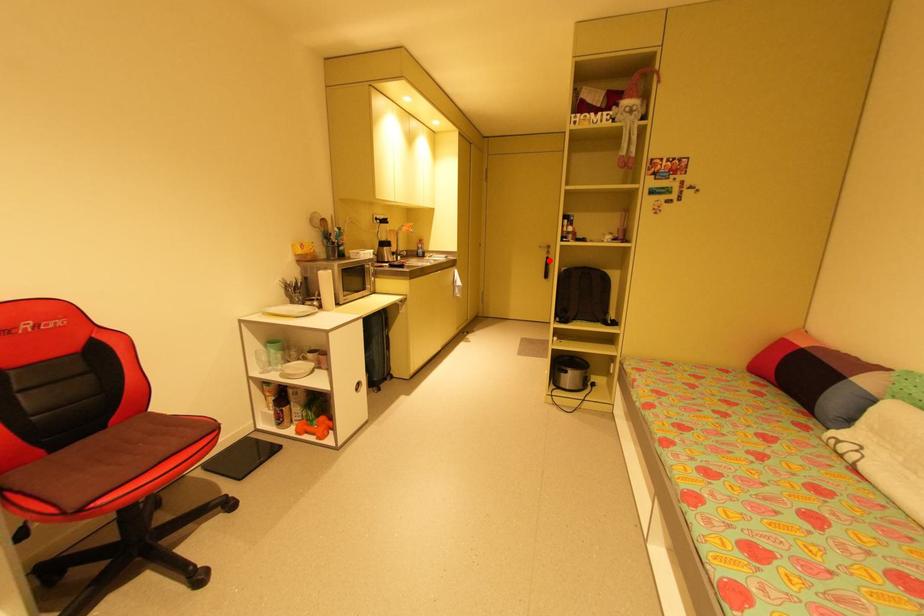
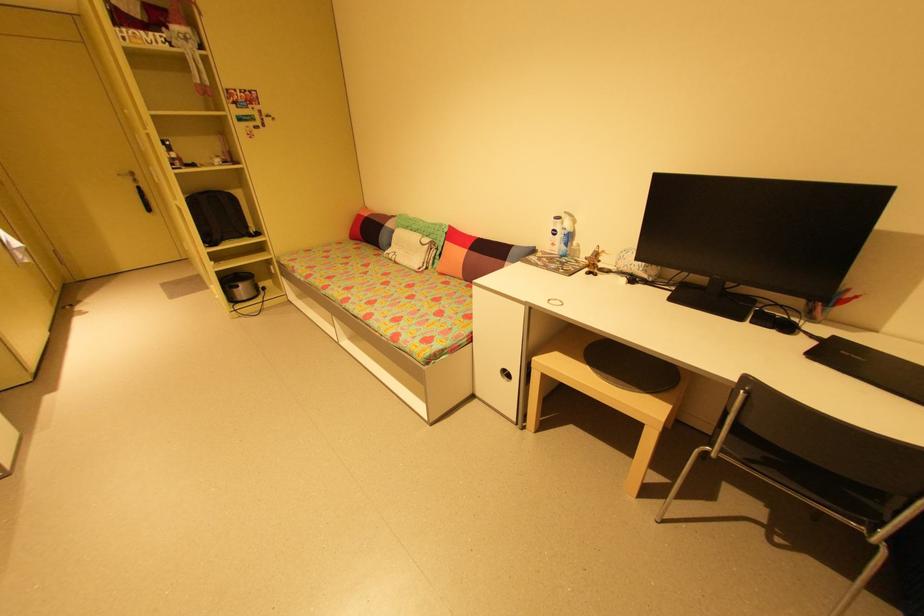
Where in the second image is the point corresponding to the highlighted location from the first image?

(140, 191)